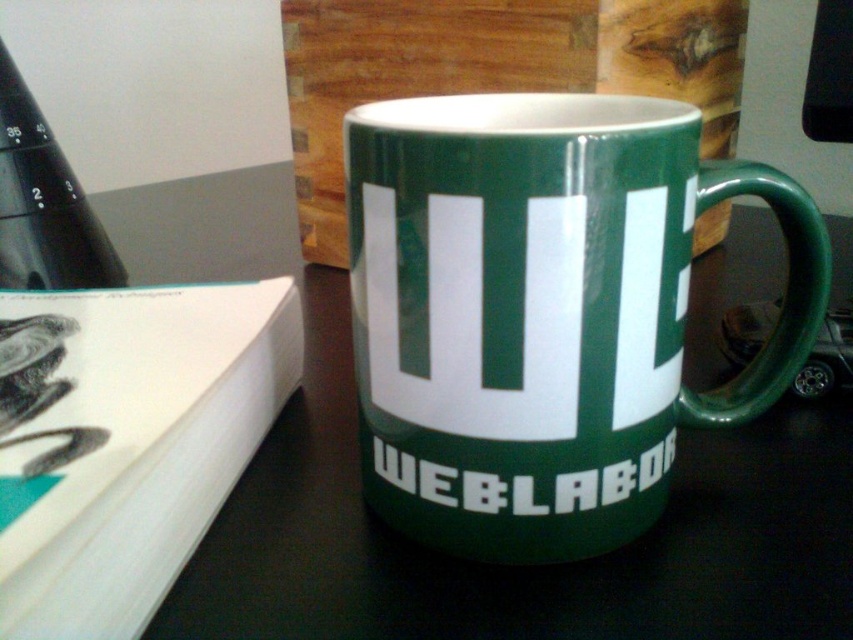
Is green glossy table at center smaller than white paper at upper left?

Actually, green glossy table at center might be larger than white paper at upper left.

Is point (601, 632) behind point (183, 422)?

No.

Locate an element on the screen. The height and width of the screenshot is (640, 853). green glossy table at center is located at coordinates (521, 566).

Does green glossy mug at center appear on the left side of white paper at upper left?

Incorrect, green glossy mug at center is not on the left side of white paper at upper left.

Who is more forward, (466,189) or (7,566)?

Point (7,566)

Locate an element on the screen. The height and width of the screenshot is (640, 853). green glossy mug at center is located at coordinates (543, 312).

Find the location of a particular element. green glossy mug at center is located at coordinates (543, 312).

This screenshot has width=853, height=640. I want to click on green glossy mug at center, so click(x=543, y=312).

Which is below, green glossy mug at center or green glossy table at center?

green glossy mug at center

This screenshot has height=640, width=853. Find the location of `green glossy mug at center`. green glossy mug at center is located at coordinates (543, 312).

Image resolution: width=853 pixels, height=640 pixels. Identify the location of green glossy mug at center. (543, 312).